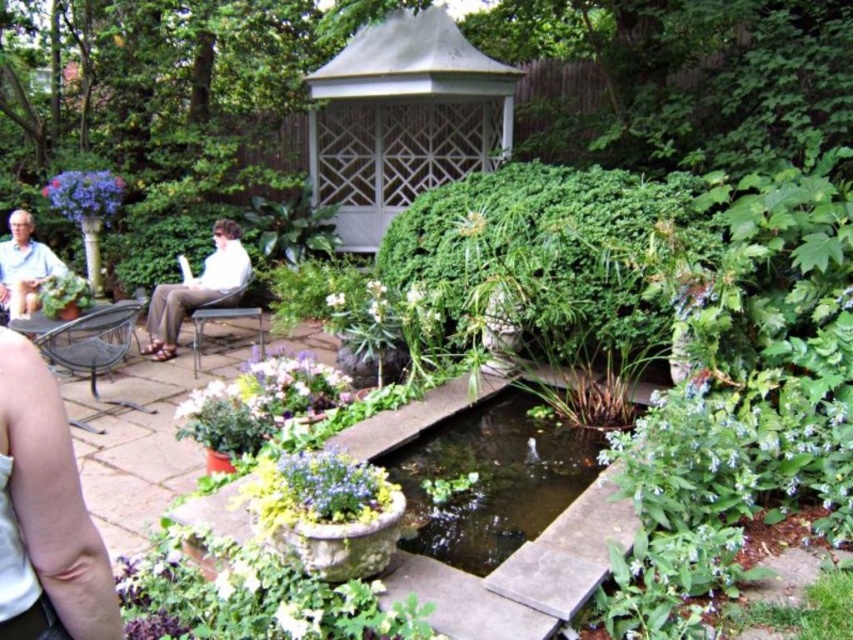
Question: Is matte purple flowers at center positioned in front of light blue shirt at upper left?

Choices:
 (A) no
 (B) yes

Answer: (B)

Question: Can you confirm if smooth white arm at lower left is positioned below matte purple flowers at center?

Choices:
 (A) yes
 (B) no

Answer: (B)

Question: Based on their relative distances, which object is farther from the matte purple flowers at upper left?

Choices:
 (A) clear concrete pond at center
 (B) white matte shirt at center
 (C) white matte flower at center

Answer: (A)

Question: Which is nearer to the matte purple flowers at upper left?

Choices:
 (A) clear concrete pond at center
 (B) matte purple flowers at center
 (C) light blue shirt at upper left
 (D) smooth white arm at lower left

Answer: (C)

Question: Does smooth white arm at lower left appear on the right side of white matte flower at center?

Choices:
 (A) no
 (B) yes

Answer: (B)

Question: Which object appears closest to the camera in this image?

Choices:
 (A) smooth white arm at lower left
 (B) matte purple flowers at upper left
 (C) white matte shirt at center

Answer: (A)